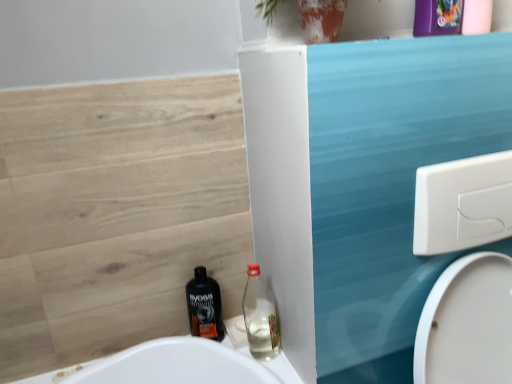
Question: In the image, is clear glass bottle at lower center, which is the second bottle in left-to-right order, on the left side or the right side of black plastic bottle at lower center, the 1th bottle when ordered from left to right?

Choices:
 (A) left
 (B) right

Answer: (B)

Question: Is clear glass bottle at lower center, which appears as the first bottle when viewed from the right, in front of or behind black plastic bottle at lower center, marked as the second bottle in a right-to-left arrangement, in the image?

Choices:
 (A) front
 (B) behind

Answer: (A)

Question: Considering the positions of point (x=248, y=279) and point (x=199, y=279), is point (x=248, y=279) closer or farther from the camera than point (x=199, y=279)?

Choices:
 (A) closer
 (B) farther

Answer: (B)

Question: Is black plastic bottle at lower center, the 1th bottle when ordered from left to right, taller or shorter than clear glass bottle at lower center, which appears as the first bottle when viewed from the right?

Choices:
 (A) tall
 (B) short

Answer: (A)

Question: Do you think black plastic bottle at lower center, marked as the second bottle in a right-to-left arrangement, is within clear glass bottle at lower center, which appears as the first bottle when viewed from the right, or outside of it?

Choices:
 (A) outside
 (B) inside

Answer: (A)

Question: From the image's perspective, is black plastic bottle at lower center, marked as the second bottle in a right-to-left arrangement, located above or below clear glass bottle at lower center, which appears as the first bottle when viewed from the right?

Choices:
 (A) above
 (B) below

Answer: (B)

Question: Relative to clear glass bottle at lower center, which appears as the first bottle when viewed from the right, is black plastic bottle at lower center, the 1th bottle when ordered from left to right, in front or behind?

Choices:
 (A) front
 (B) behind

Answer: (B)